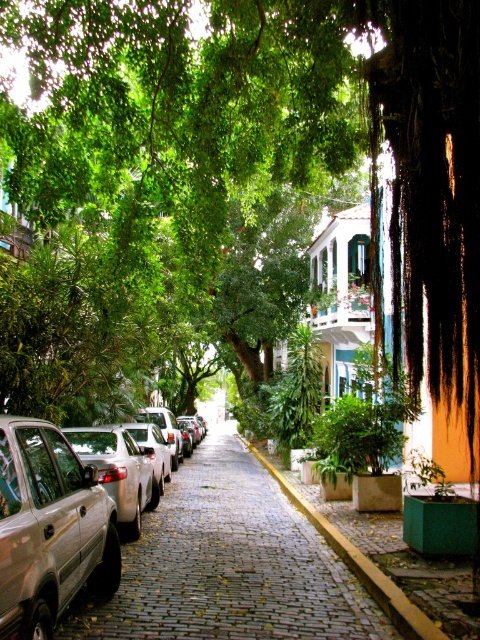
Between cobblestone pavement at center and silver metallic car at left, which one has less height?

silver metallic car at left is shorter.

Can you confirm if cobblestone pavement at center is bigger than silver metallic car at left?

Yes.

The height and width of the screenshot is (640, 480). What do you see at coordinates (239, 564) in the screenshot?
I see `cobblestone pavement at center` at bounding box center [239, 564].

Where is `cobblestone pavement at center`? This screenshot has height=640, width=480. cobblestone pavement at center is located at coordinates (239, 564).